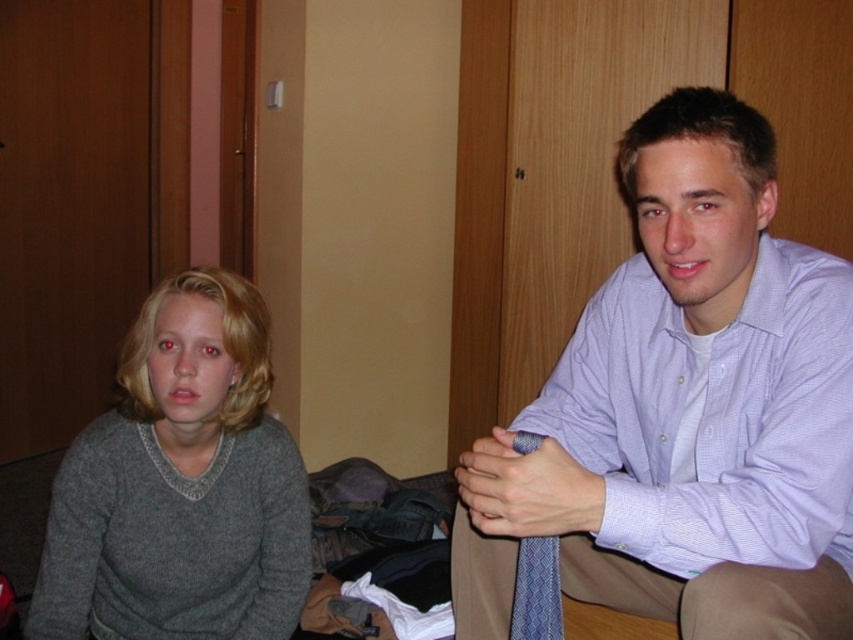
Question: Which point is farther to the camera?

Choices:
 (A) (543, 582)
 (B) (216, 330)
 (C) (584, 484)

Answer: (B)

Question: Does gray wool sweater at left appear over blue textured tie at center?

Choices:
 (A) yes
 (B) no

Answer: (A)

Question: Which point appears closest to the camera in this image?

Choices:
 (A) (519, 429)
 (B) (77, 509)
 (C) (618, 348)

Answer: (A)

Question: Is gray wool sweater at left above blue textured tie at center?

Choices:
 (A) no
 (B) yes

Answer: (B)

Question: Is light purple shirt at upper right to the right of blue textured tie at center from the viewer's perspective?

Choices:
 (A) no
 (B) yes

Answer: (B)

Question: Among these objects, which one is nearest to the camera?

Choices:
 (A) blue textured tie at center
 (B) light purple shirt at upper right
 (C) gray wool sweater at left

Answer: (B)